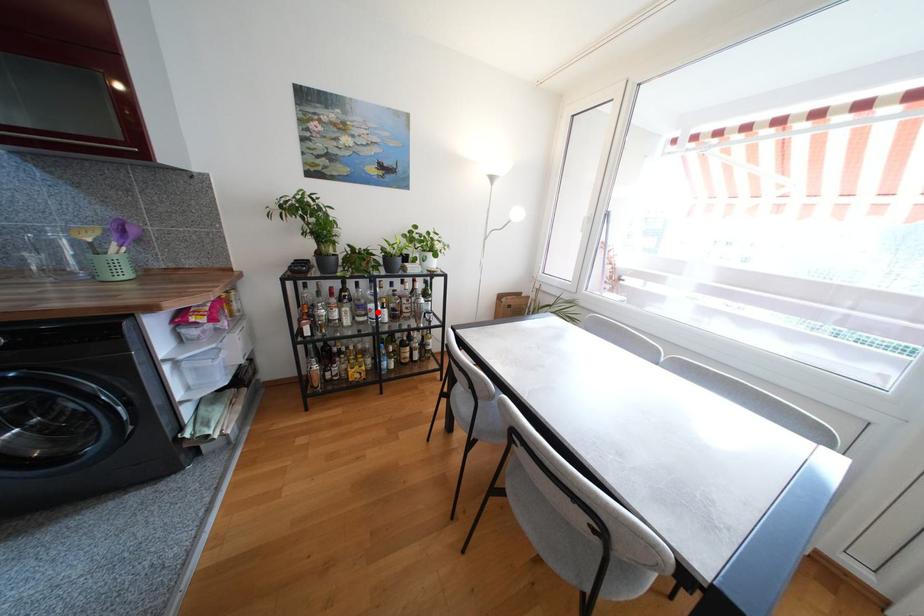
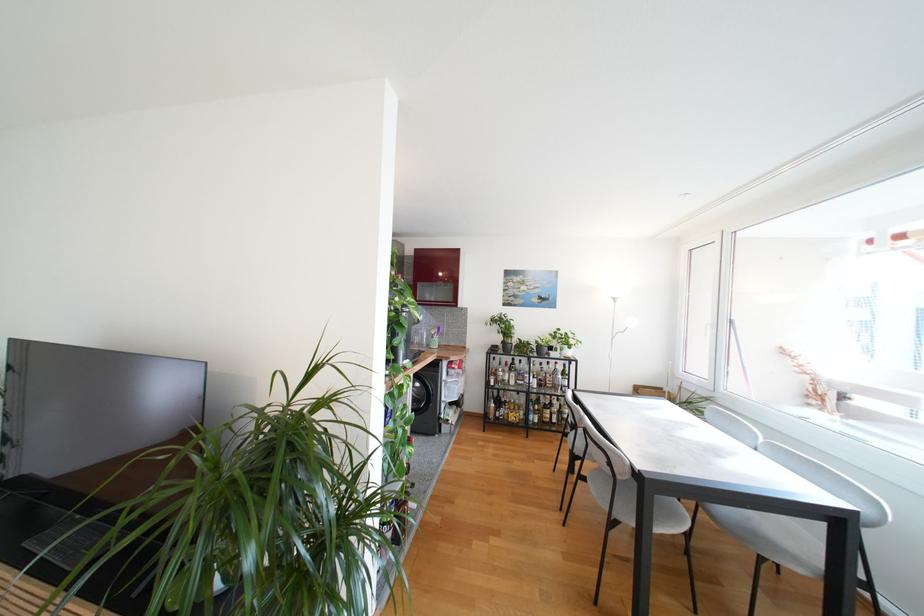
Where in the second image is the point corresponding to the highlighted location from the first image?

(532, 379)